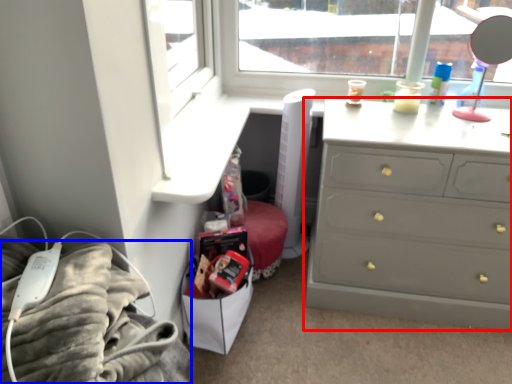
Question: Which point is further to the camera, chest of drawers (highlighted by a red box) or bedding (highlighted by a blue box)?

Choices:
 (A) chest of drawers
 (B) bedding

Answer: (A)